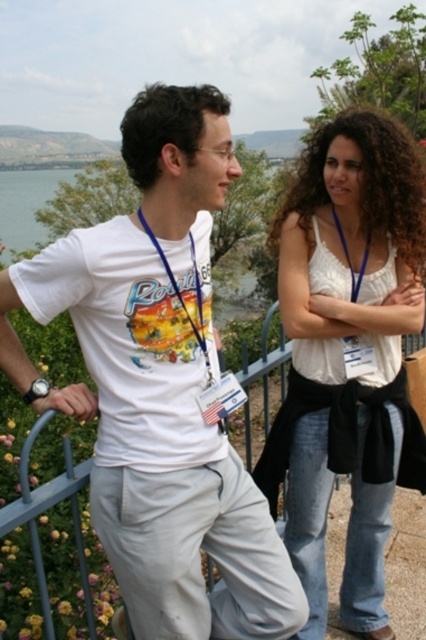
You are standing at the scenic overlook and want to place a new bench between the two points labeled point (379, 563) and point (336, 212). Which point should the bench be closer to in order to be closer to the foreground of the image?

The bench should be closer to point (379, 563) because it is further to the viewer than point (336, 212), making it closer to the foreground.